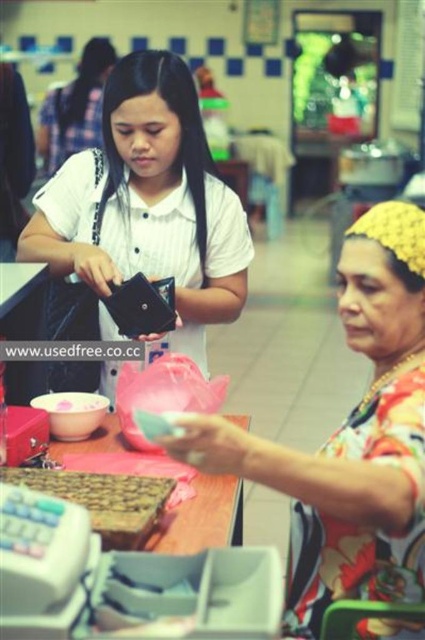
Question: Does floral fabric blouse at center have a greater width compared to wooden table at center?

Choices:
 (A) no
 (B) yes

Answer: (B)

Question: Which of the following is the closest to the observer?

Choices:
 (A) wooden tray at lower left
 (B) floral fabric blouse at center

Answer: (B)

Question: Which point appears farthest from the camera in this image?

Choices:
 (A) (201, 248)
 (B) (418, 253)
 (C) (36, 474)

Answer: (A)

Question: Which point appears farthest from the camera in this image?

Choices:
 (A) (57, 448)
 (B) (115, 97)

Answer: (B)

Question: Is wooden tray at lower left further to camera compared to wooden table at center?

Choices:
 (A) no
 (B) yes

Answer: (A)

Question: Does floral fabric blouse at center have a smaller size compared to matte black wallet at center?

Choices:
 (A) no
 (B) yes

Answer: (B)